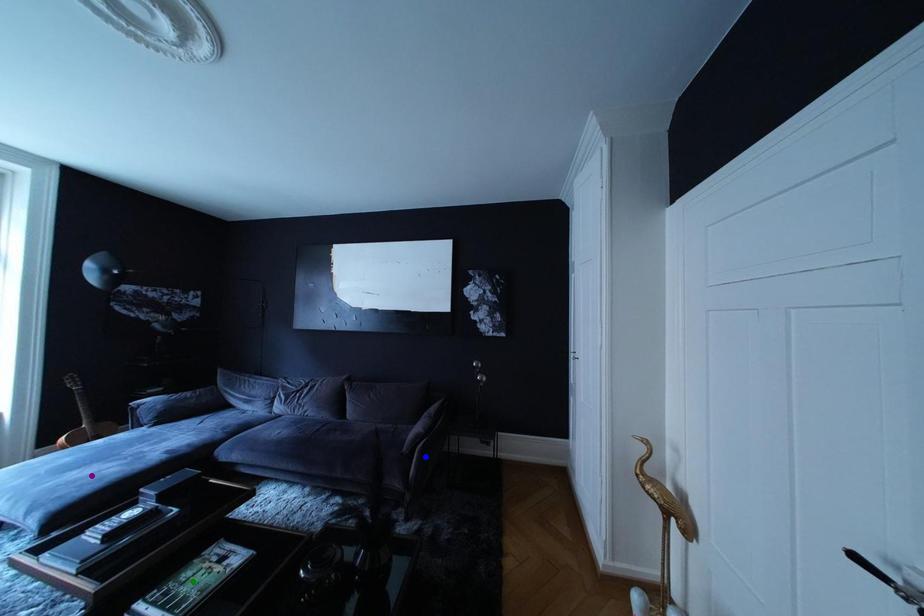
Order these from nearest to farthest:
- purple point
- green point
- blue point

blue point → purple point → green point